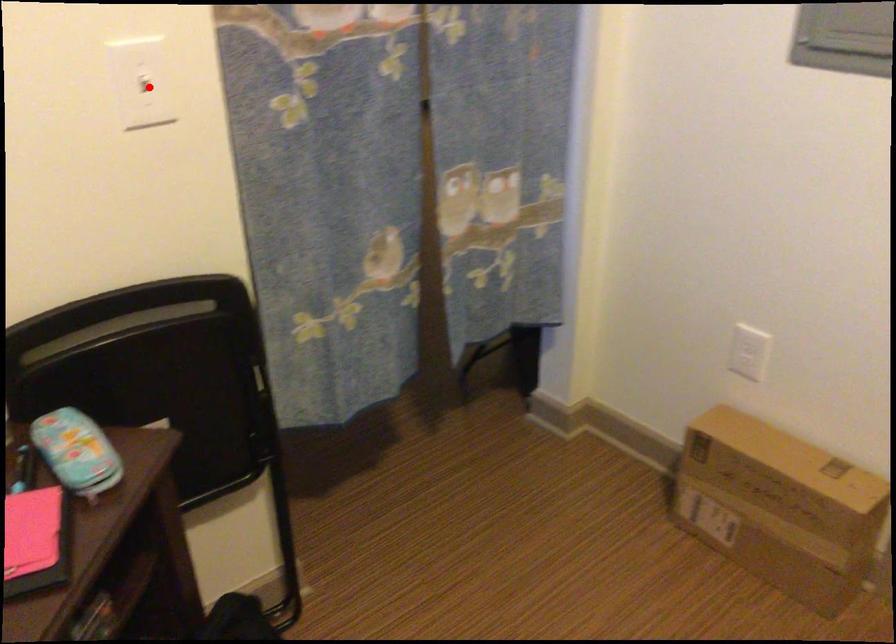
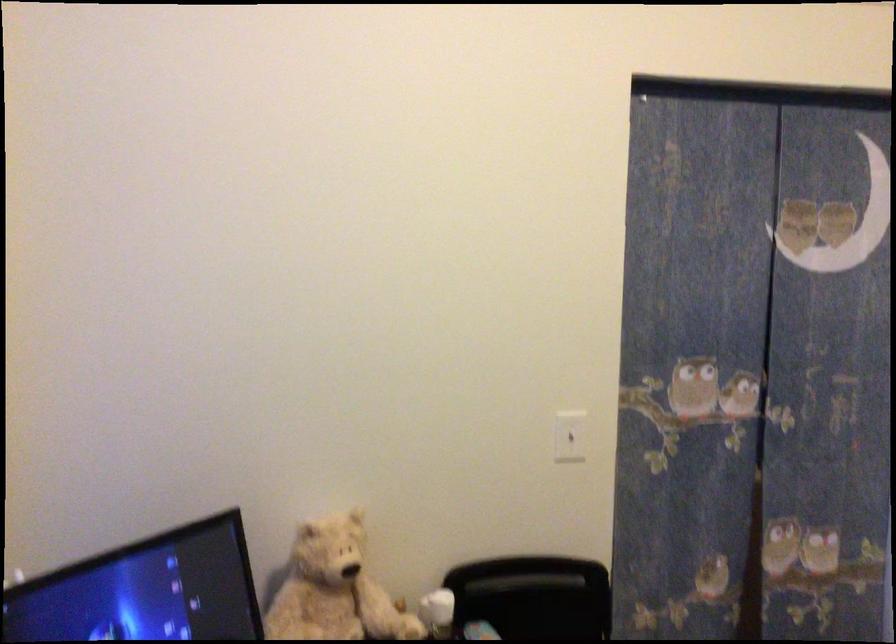
The point at the highlighted location is marked in the first image. Where is the corresponding point in the second image?

(570, 436)